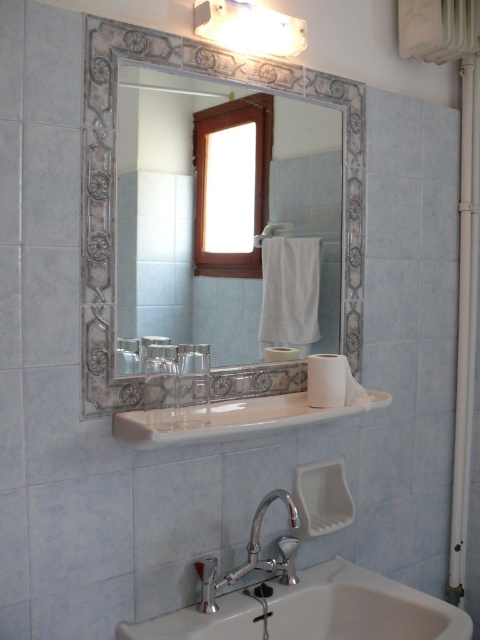
Who is shorter, white ceramic sink at lower center or white fabric towel bar at center?

white fabric towel bar at center

The image size is (480, 640). Identify the location of white ceramic sink at lower center. (314, 611).

Can you confirm if white glossy light fixture at upper center is taller than white fabric towel bar at center?

Yes.

Where is `white glossy light fixture at upper center`? This screenshot has height=640, width=480. white glossy light fixture at upper center is located at coordinates (249, 28).

Is white glossy sink at center wider than white glossy light fixture at upper center?

Yes, white glossy sink at center is wider than white glossy light fixture at upper center.

Consider the image. Is white glossy sink at center further to the viewer compared to white glossy light fixture at upper center?

No.

Measure the distance between point (222, 404) and camera.

They are 4.54 feet apart.

I want to click on white glossy sink at center, so click(x=240, y=419).